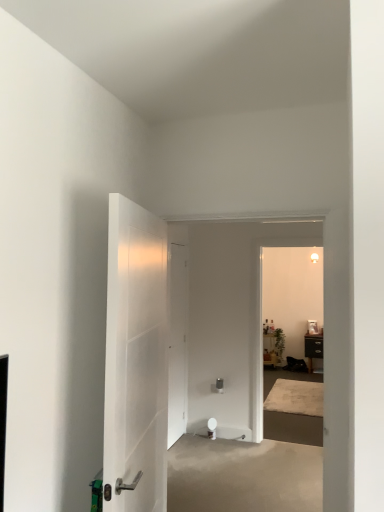
Question: Based on their sizes in the image, would you say black matte cabinet at right, the 1th furniture viewed from the right, is bigger or smaller than wooden side table at center, which is the second furniture in right-to-left order?

Choices:
 (A) big
 (B) small

Answer: (A)

Question: From a real-world perspective, is black matte cabinet at right, the 1th furniture viewed from the right, physically located above or below wooden side table at center, which ranks as the first furniture in left-to-right order?

Choices:
 (A) above
 (B) below

Answer: (A)

Question: Which object is positioned closest to the beige concrete at center?

Choices:
 (A) white glossy door at center, marked as the 2th door in a back-to-front arrangement
 (B) black matte cabinet at right, which is counted as the 2th furniture, starting from the left
 (C) white matte door at center, positioned as the 2th door in front-to-back order
 (D) wooden side table at center, which ranks as the first furniture in left-to-right order

Answer: (C)

Question: Considering the real-world distances, which object is closest to the white matte door at center, positioned as the 2th door in front-to-back order?

Choices:
 (A) black matte cabinet at right, the 1th furniture viewed from the right
 (B) wooden side table at center, which ranks as the first furniture in left-to-right order
 (C) beige concrete at center
 (D) white glossy door at center, marked as the 2th door in a back-to-front arrangement

Answer: (C)